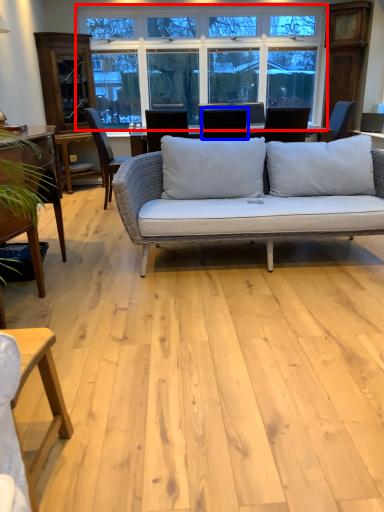
Question: Which point is further to the camera, window (highlighted by a red box) or chair (highlighted by a blue box)?

Choices:
 (A) window
 (B) chair

Answer: (A)